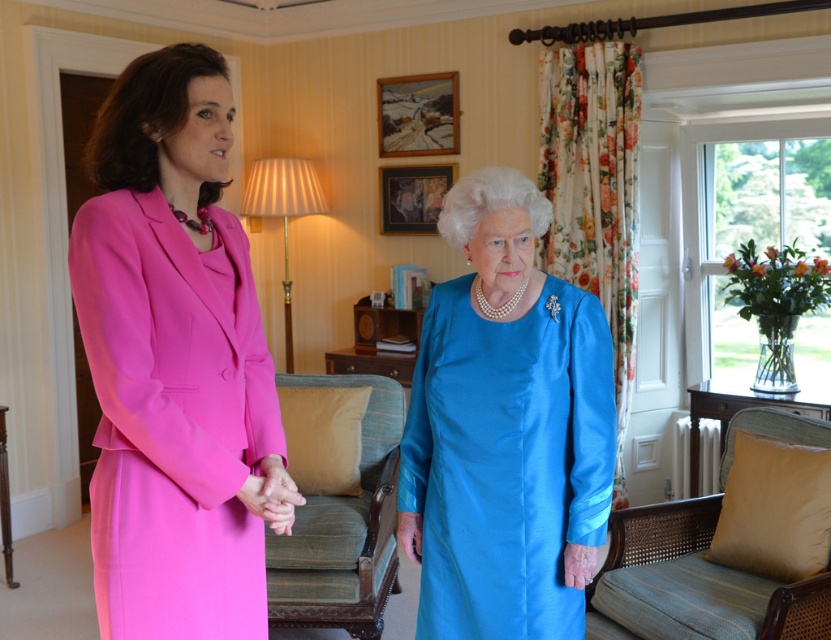
Question: Which object appears farthest from the camera in this image?

Choices:
 (A) matte pink suit at left
 (B) satin blue dress at center
 (C) green fabric armchair at center

Answer: (C)

Question: Where is satin blue dress at center located in relation to blue fabric armchair at lower right in the image?

Choices:
 (A) above
 (B) below

Answer: (A)

Question: Which point is farther from the camera taking this photo?

Choices:
 (A) (466, 525)
 (B) (274, 467)
 (C) (279, 616)
 (D) (124, 301)

Answer: (C)

Question: Where is satin blue dress at center located in relation to matte pink dress at center in the image?

Choices:
 (A) left
 (B) right

Answer: (B)

Question: Can you confirm if satin blue dress at center is smaller than blue fabric armchair at lower right?

Choices:
 (A) yes
 (B) no

Answer: (A)

Question: Which object is the farthest from the satin blue dress at center?

Choices:
 (A) matte pink dress at center
 (B) matte pink suit at left
 (C) green fabric armchair at center

Answer: (C)